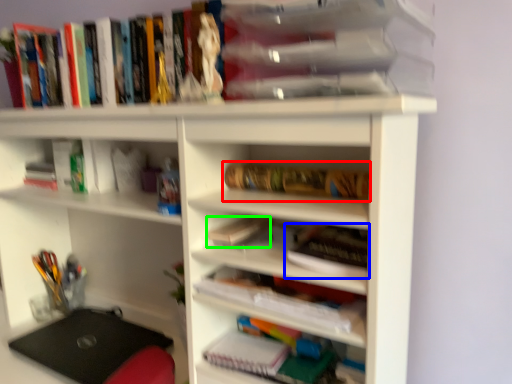
Question: Considering the real-world distances, which object is farthest from book (highlighted by a red box)? book (highlighted by a blue box) or book (highlighted by a green box)?

Choices:
 (A) book
 (B) book

Answer: (B)